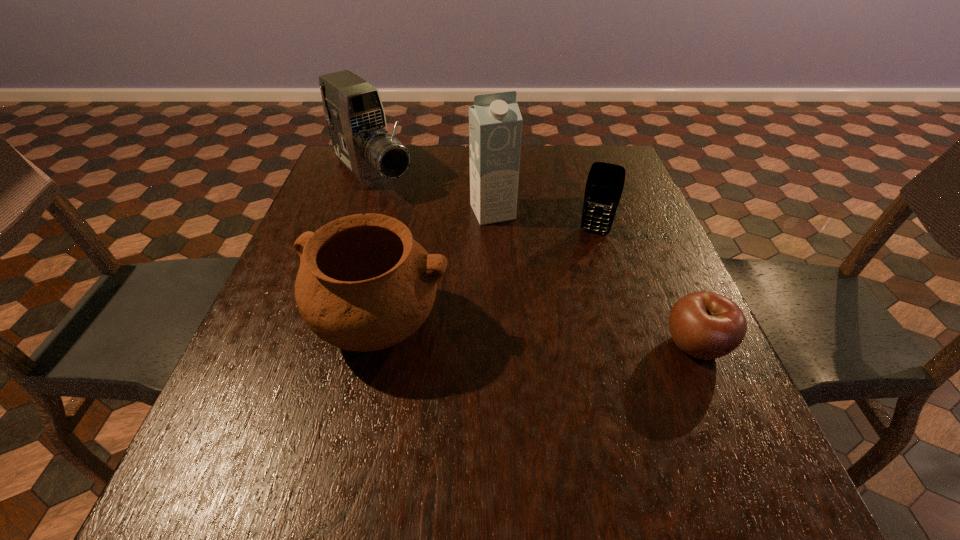
Locate an element on the screen. This screenshot has width=960, height=540. free spot between the shortest object and the third object from right to left is located at coordinates (594, 278).

The width and height of the screenshot is (960, 540). I want to click on blank region between the fourth shortest object and the tallest object, so click(x=433, y=194).

The width and height of the screenshot is (960, 540). Identify the location of vacant space that's between the carton and the camcorder. (433, 194).

Select which object is the closest to the third object from right to left. Please provide its 2D coordinates. Your answer should be formatted as a tuple, i.e. [(x, y)], where the tuple contains the x and y coordinates of a point satisfying the conditions above.

[(605, 182)]

Point out which object is positioned as the second nearest to the apple. Please provide its 2D coordinates. Your answer should be formatted as a tuple, i.e. [(x, y)], where the tuple contains the x and y coordinates of a point satisfying the conditions above.

[(495, 123)]

Identify the location of free region that satisfies the following two spatial constraints: 1. on the front side of the third object from right to left; 2. on the side of the apple with the unique marking. Image resolution: width=960 pixels, height=540 pixels. (497, 344).

The width and height of the screenshot is (960, 540). In order to click on free point that satisfies the following two spatial constraints: 1. on the front side of the second object from right to left; 2. on the side of the shortest object with the unique marking in this screenshot , I will do `click(628, 344)`.

Locate an element on the screen. The height and width of the screenshot is (540, 960). free region that satisfies the following two spatial constraints: 1. on the front side of the camcorder; 2. on the side of the apple with the unique marking is located at coordinates pyautogui.click(x=319, y=344).

Identify the location of vacant space that satisfies the following two spatial constraints: 1. on the front side of the pottery; 2. on the right side of the fourth shortest object. (324, 326).